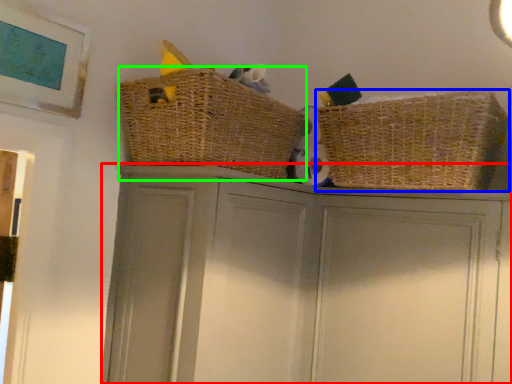
Question: Considering the real-world distances, which object is farthest from cupboard (highlighted by a red box)? basket (highlighted by a blue box) or basket (highlighted by a green box)?

Choices:
 (A) basket
 (B) basket

Answer: (A)